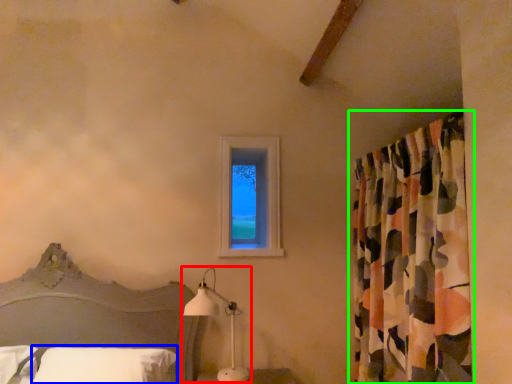
Question: Which is farther away from table lamp (highlighted by a red box)? pillow (highlighted by a blue box) or curtain (highlighted by a green box)?

Choices:
 (A) pillow
 (B) curtain

Answer: (B)